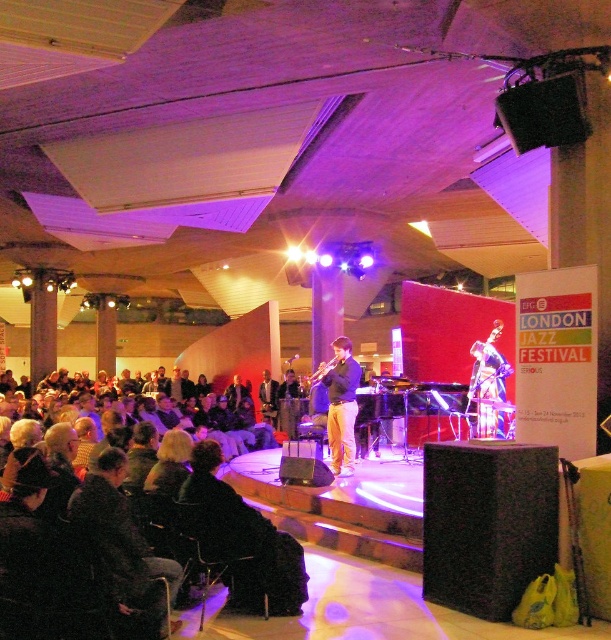
You are a photographer at the London Jazz Festival and want to capture a photo of the light brown leather pants at center and the black textured speaker at center. Based on their positions, which object should you focus on first if you are moving from left to right across the stage?

The light brown leather pants at center should be focused on first because the black textured speaker at center is positioned to its right.

You are a photographer at the London Jazz Festival and want to capture a closeup shot of the trumpet player. You notice the light brown leather pants at center and the dark brown leather jacket at center. Which item should you focus on if you want to ensure it fills the frame more due to its size?

The light brown leather pants at center might be wider than dark brown leather jacket at center, so focusing on the light brown leather pants at center would likely fill the frame more due to its potential larger width.

You are a photographer at the London Jazz Festival. You want to capture a photo of the musician wearing the light brown leather pants at center and the dark brown leather jacket at center. Since you want both items to be clearly visible in the photo, which one should you focus on first to ensure it isn t cropped out?

The light brown leather pants at center is much taller than the dark brown leather jacket at center, so you should focus on the light brown leather pants at center first to ensure it isn t cropped out.